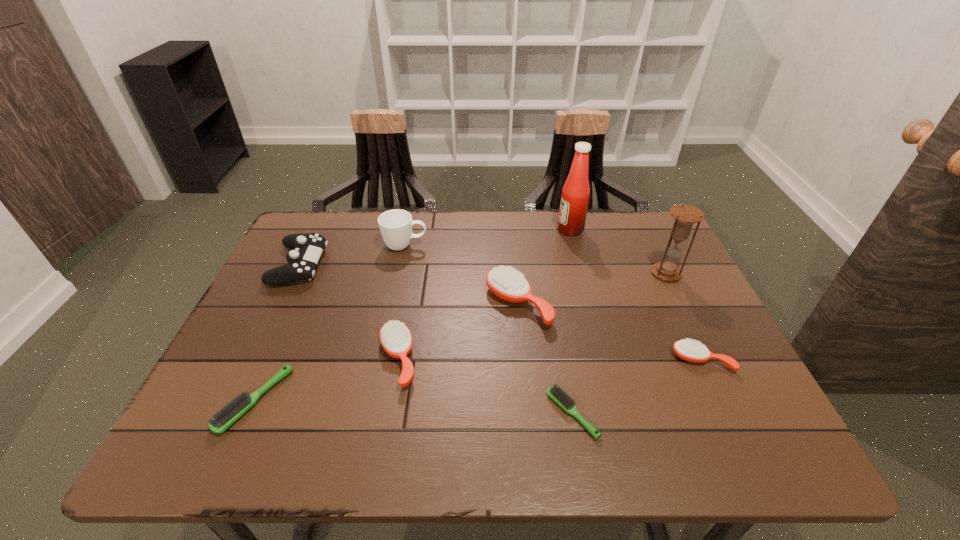
Find the location of a particular element. free space located with the handle on the side of the third tallest object is located at coordinates (468, 246).

Locate an element on the screen. The width and height of the screenshot is (960, 540). free space located on the surface of the black control is located at coordinates (420, 265).

Find the location of a particular element. The height and width of the screenshot is (540, 960). vacant space located 0.110m on the front of the tallest hairbrush is located at coordinates (524, 370).

At what (x,y) coordinates should I click in order to perform the action: click on free spot located on the right of the second biggest orange hairbrush. Please return your answer as a coordinate pair (x, y). The height and width of the screenshot is (540, 960). Looking at the image, I should click on (486, 359).

Where is `vacant space located 0.380m on the left of the smallest orange hairbrush`? vacant space located 0.380m on the left of the smallest orange hairbrush is located at coordinates (503, 360).

Image resolution: width=960 pixels, height=540 pixels. What are the coordinates of `free space located on the back of the left light hairbrush` in the screenshot? It's located at click(x=294, y=313).

This screenshot has width=960, height=540. In order to click on free space located 0.190m on the right of the right light hairbrush in this screenshot , I will do `click(691, 414)`.

Find the location of `condiment that is at the far edge`. condiment that is at the far edge is located at coordinates (575, 194).

Where is `cup present at the far edge`? The height and width of the screenshot is (540, 960). cup present at the far edge is located at coordinates (395, 225).

I want to click on control that is at the far edge, so click(302, 260).